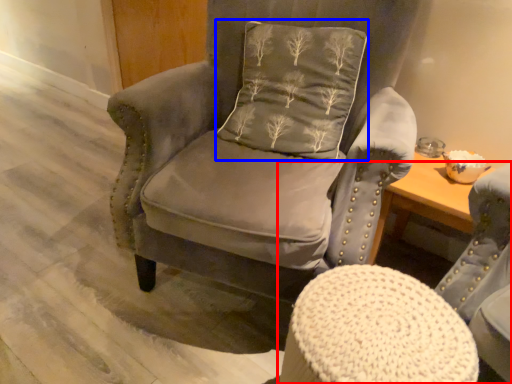
Question: Which point is closer to the camera, chair (highlighted by a red box) or pillow (highlighted by a blue box)?

Choices:
 (A) chair
 (B) pillow

Answer: (A)